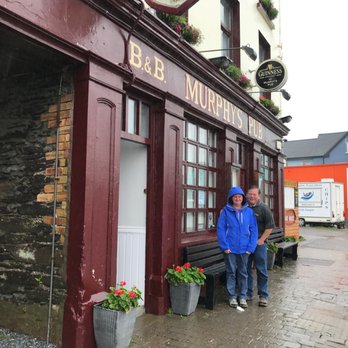
At what (x,y) coordinates should I click in order to perform the action: click on left flower pot. Please return your answer as a coordinate pair (x, y). This screenshot has width=348, height=348. Looking at the image, I should click on (116, 330).